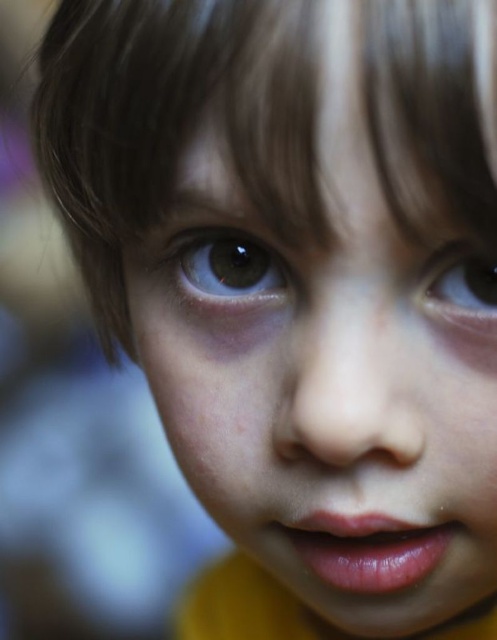
You are a photographer adjusting the focus on a camera. You notice two brown glossy eyes in the viewfinder. The child has a brown glossy eye at center and a brown glossy eye at upper right. Which eye should you focus on to ensure the closest one to the camera is sharp?

The brown glossy eye at center is closer to the camera than the brown glossy eye at upper right, so you should focus on the brown glossy eye at center to ensure it is sharp.

In the scene shown: You are a photographer adjusting the focus on a camera. The subject is a child with a brown glossy eye at center. To ensure the eye is in focus, where should you adjust the focus point on the camera screen? Please provide coordinates in the format of x,y between 0 and 1.

The brown glossy eye at center is located at coordinates point (229, 268), so you should adjust the focus point to (229, 268) to ensure it is in focus.